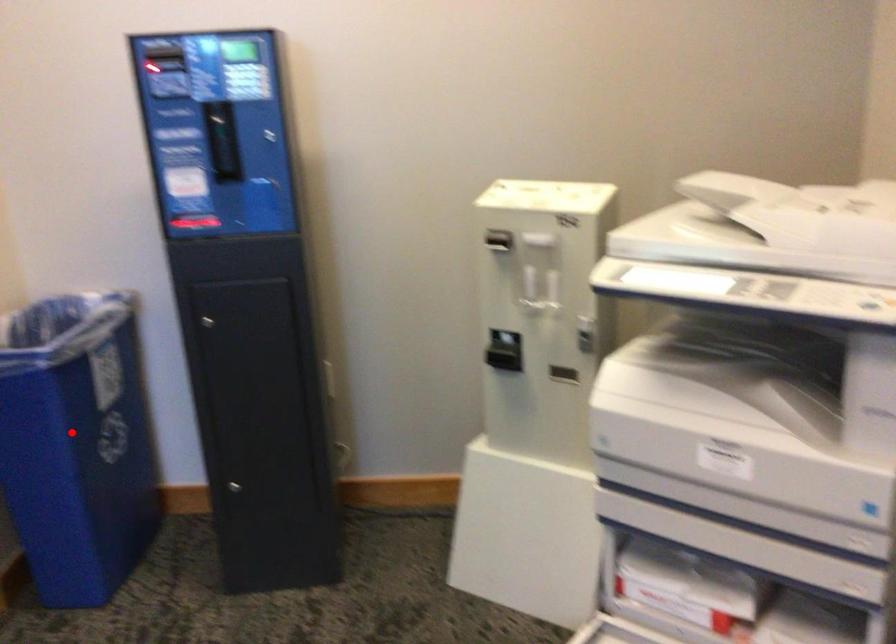
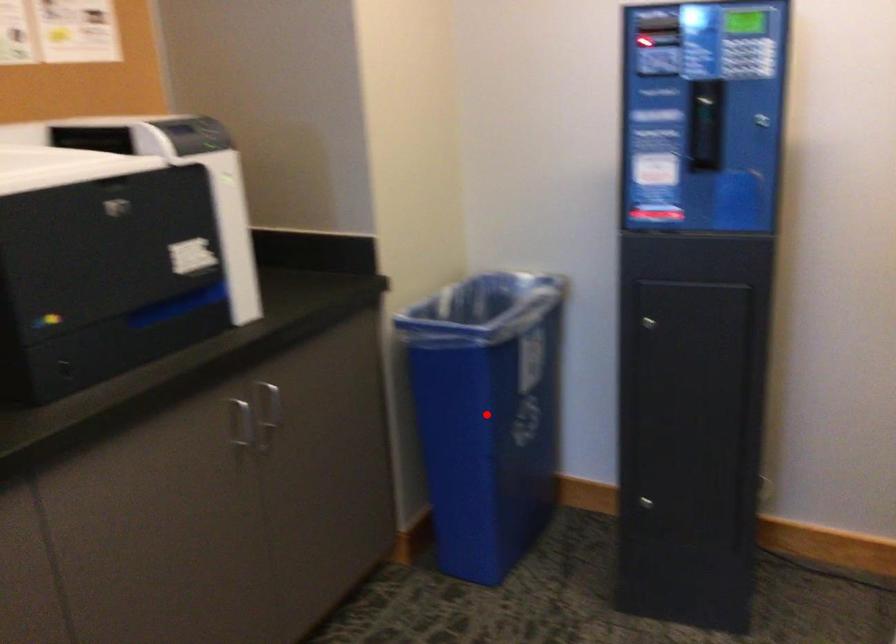
I am providing you with two images of the same scene from different viewpoints. A red point is marked on the first image and another point is marked on the second image. Is the marked point in image1 the same physical position as the marked point in image2?

Yes